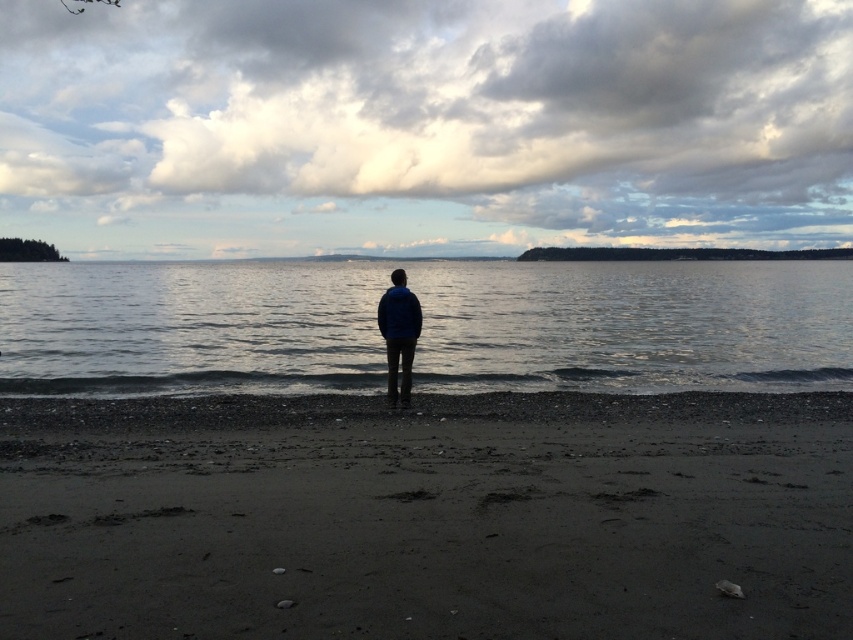
Consider the image. You are a beachcomber searching for treasures on the beach. You notice dark sand at center and clear water at center. Which object is located below the other?

The dark sand at center is positioned under clear water at center, so the dark sand is below the clear water.

You are a photographer positioned on the beach and want to capture the blue matte jacket at center and the clear water at center in a single frame. Based on their positions, which object would appear closer to the camera in the photo?

The clear water at center appears closer to the camera because it is taller than the blue matte jacket at center, indicating it occupies more of the foreground in the image.